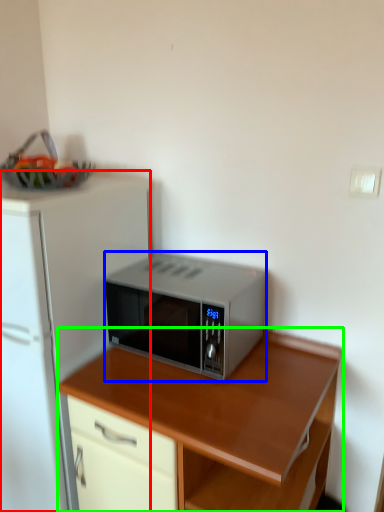
Question: Which is nearer to the refrigerator (highlighted by a red box)? microwave oven (highlighted by a blue box) or desk (highlighted by a green box).

Choices:
 (A) microwave oven
 (B) desk

Answer: (A)